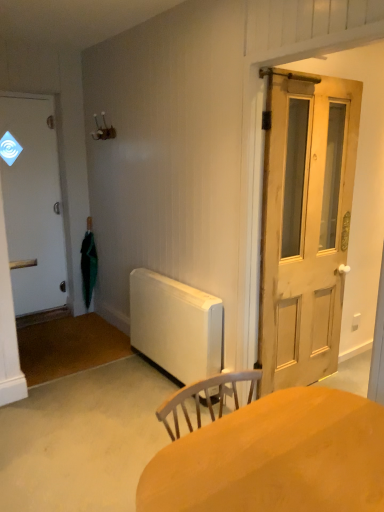
Question: In terms of size, does natural wood door at right, which is counted as the 2th door, starting from the left, appear bigger or smaller than white matte door at left, the second door in the right-to-left sequence?

Choices:
 (A) big
 (B) small

Answer: (A)

Question: Is natural wood door at right, which appears as the second door when viewed from the back, taller or shorter than white matte door at left, the first door positioned from the left?

Choices:
 (A) short
 (B) tall

Answer: (A)

Question: Which is nearer to the smooth wooden desk at center?

Choices:
 (A) white matte radiator at center
 (B) green matte umbrella at left
 (C) white matte door at left, the 1th door when ordered from back to front
 (D) natural wood door at right, which is the 1th door in right-to-left order

Answer: (D)

Question: Estimate the real-world distances between objects in this image. Which object is farther from the natural wood door at right, placed as the first door when sorted from front to back?

Choices:
 (A) green matte umbrella at left
 (B) white matte door at left, the second door in the right-to-left sequence
 (C) white matte radiator at center
 (D) smooth wooden desk at center

Answer: (B)